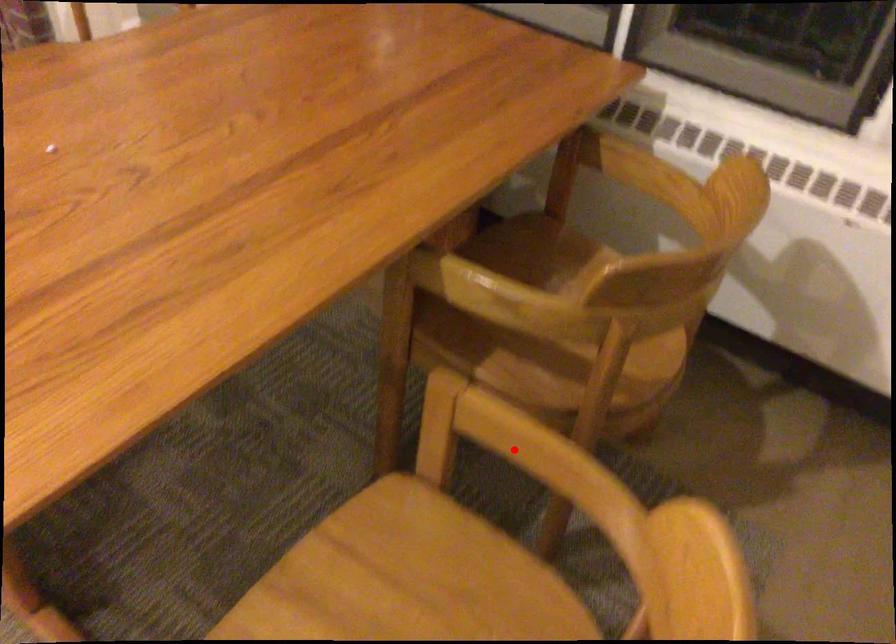
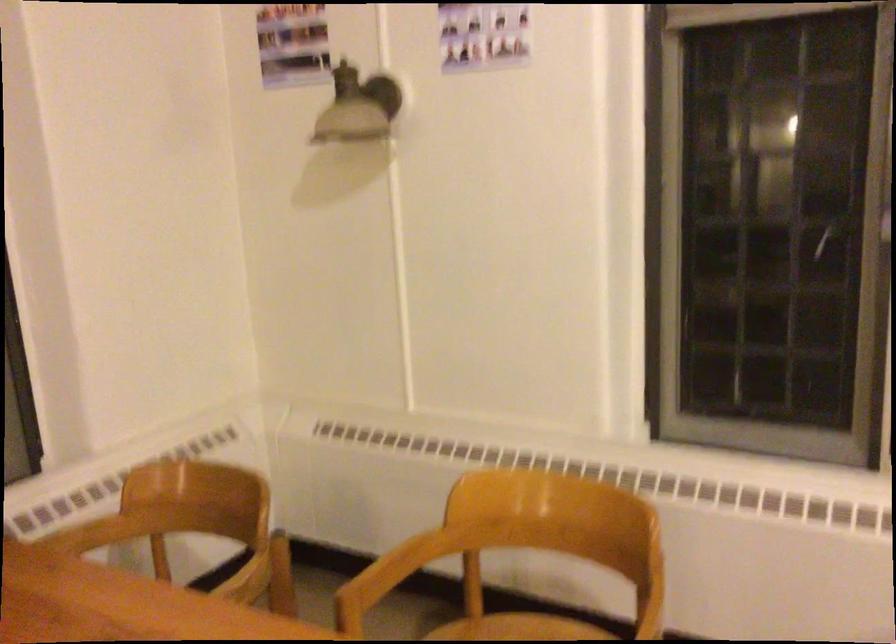
Question: A red point is marked in image1. In image2, is the corresponding 3D point closer to the camera or farther? Reply with the corresponding letter.

Choices:
 (A) The corresponding 3D point is closer.
 (B) The corresponding 3D point is farther.

Answer: (B)